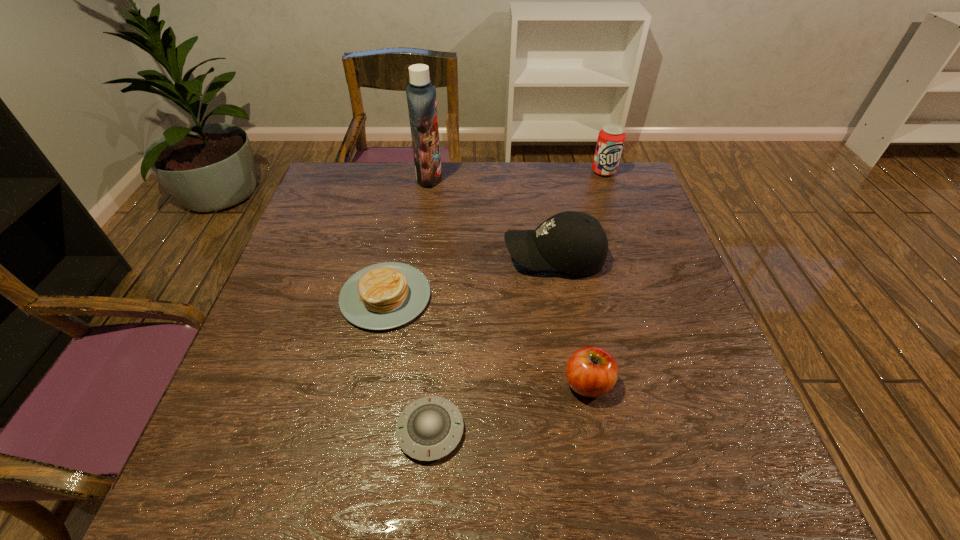
Identify the location of the tallest object. The image size is (960, 540). (421, 96).

The height and width of the screenshot is (540, 960). Find the location of `the rightmost object`. the rightmost object is located at coordinates (611, 137).

Identify the location of baseball cap. (573, 242).

Locate an element on the screen. This screenshot has width=960, height=540. the fourth tallest object is located at coordinates (591, 371).

Locate an element on the screen. pancake is located at coordinates (387, 295).

You are a GUI agent. You are given a task and a screenshot of the screen. Output one action in this format:
    pyautogui.click(x=<x>, y=<y>)
    Task: Click on the saucer
    The width and height of the screenshot is (960, 540).
    Given the screenshot: What is the action you would take?
    pyautogui.click(x=429, y=428)

This screenshot has height=540, width=960. In order to click on free region located on the front label of the shampoo in this screenshot , I will do `click(506, 177)`.

In order to click on vacant region located on the surface of the rightmost object in this screenshot , I will do `click(636, 261)`.

Identify the location of free point located 0.240m on the front-facing side of the baseball cap. point(409,257).

Locate an element on the screen. Image resolution: width=960 pixels, height=540 pixels. vacant space located on the front-facing side of the baseball cap is located at coordinates (362, 257).